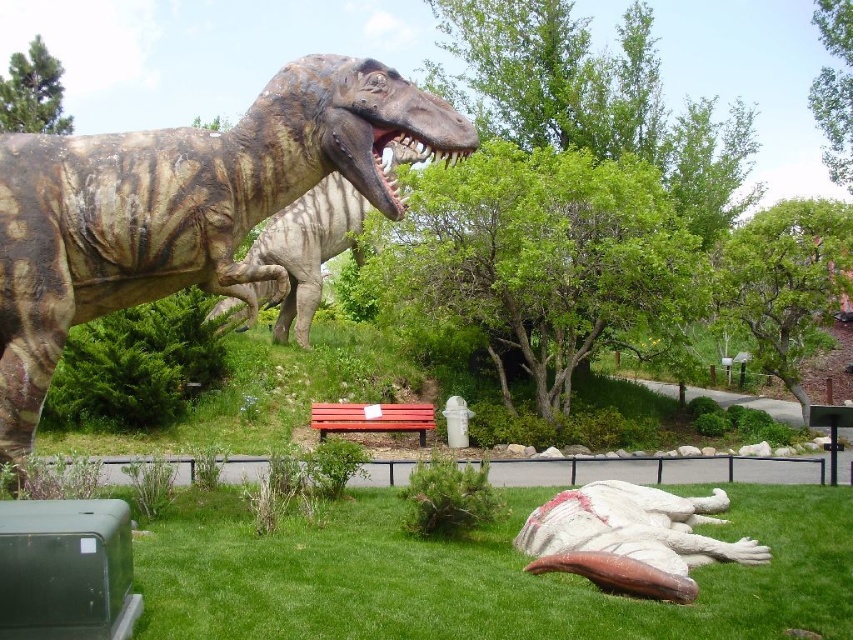
Question: From the image, what is the correct spatial relationship of camouflage textured dinosaur at upper left in relation to white marble dinosaur at lower right?

Choices:
 (A) left
 (B) right

Answer: (A)

Question: Is green grass at lower right thinner than wooden park bench at center?

Choices:
 (A) yes
 (B) no

Answer: (A)

Question: Which object is positioned closest to the green grass at lower right?

Choices:
 (A) wooden park bench at center
 (B) camouflage textured dinosaur at upper left
 (C) white marble dinosaur at lower right

Answer: (C)

Question: Does green grass at lower right appear under camouflage textured dinosaur at upper left?

Choices:
 (A) yes
 (B) no

Answer: (A)

Question: Considering the real-world distances, which object is closest to the white marble dinosaur at lower right?

Choices:
 (A) green grass at lower right
 (B) camouflage textured dinosaur at upper left
 (C) wooden park bench at center

Answer: (A)

Question: Which object is the farthest from the white marble dinosaur at lower right?

Choices:
 (A) wooden park bench at center
 (B) camouflage textured dinosaur at upper left
 (C) green grass at lower right

Answer: (A)